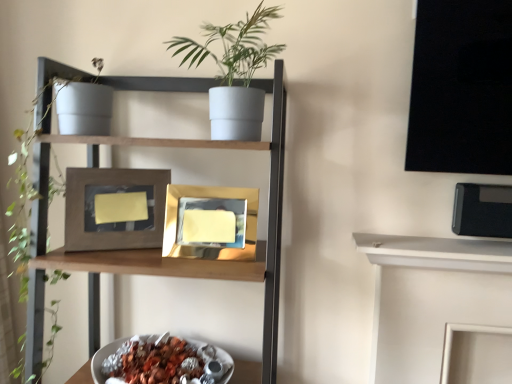
This screenshot has height=384, width=512. I want to click on empty space that is ontop of gold reflective photo frame at center, the 2th picture frame from the left, so click(207, 186).